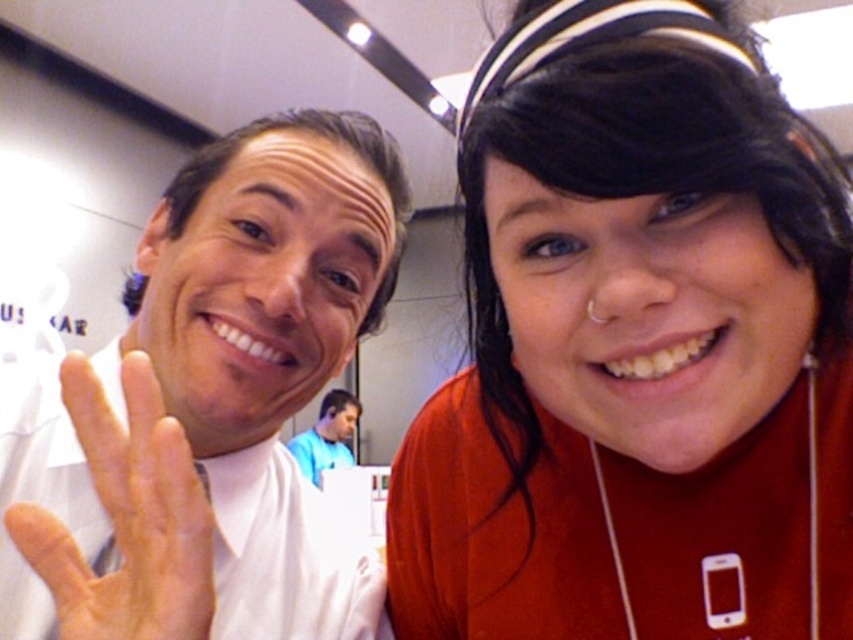
You are a photographer trying to capture a clear shot of the silver metallic earphone at upper right and the blue fabric shirt at center. Which object is closer to the camera?

The blue fabric shirt at center is closer to the camera because the silver metallic earphone at upper right is behind it.